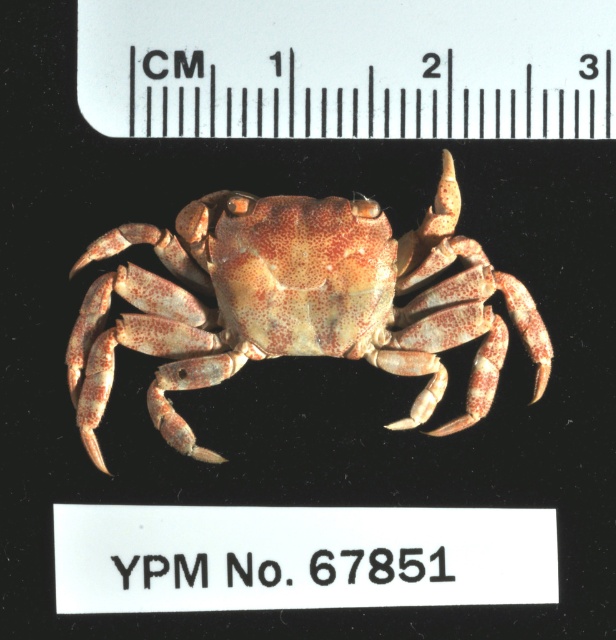
Can you confirm if white plastic ruler at upper center is positioned below speckled beige crab at center?

Incorrect, white plastic ruler at upper center is not positioned below speckled beige crab at center.

Is point (529, 86) positioned behind point (208, 244)?

No, it is in front of (208, 244).

You are a GUI agent. You are given a task and a screenshot of the screen. Output one action in this format:
    pyautogui.click(x=<x>, y=<y>)
    Task: Click on the white plastic ruler at upper center
    The height and width of the screenshot is (640, 616).
    Given the screenshot: What is the action you would take?
    pyautogui.click(x=347, y=68)